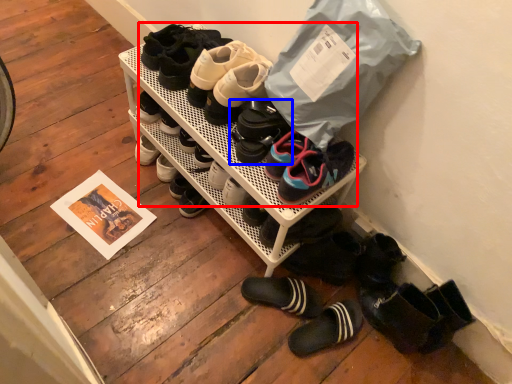
Question: Among these objects, which one is farthest to the camera, footwear (highlighted by a red box) or footwear (highlighted by a blue box)?

Choices:
 (A) footwear
 (B) footwear

Answer: (B)